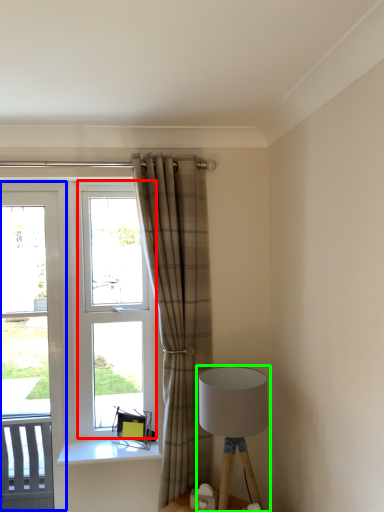
Question: Considering the real-world distances, which object is closest to window (highlighted by a red box)? screen door (highlighted by a blue box) or lamp (highlighted by a green box).

Choices:
 (A) screen door
 (B) lamp

Answer: (A)